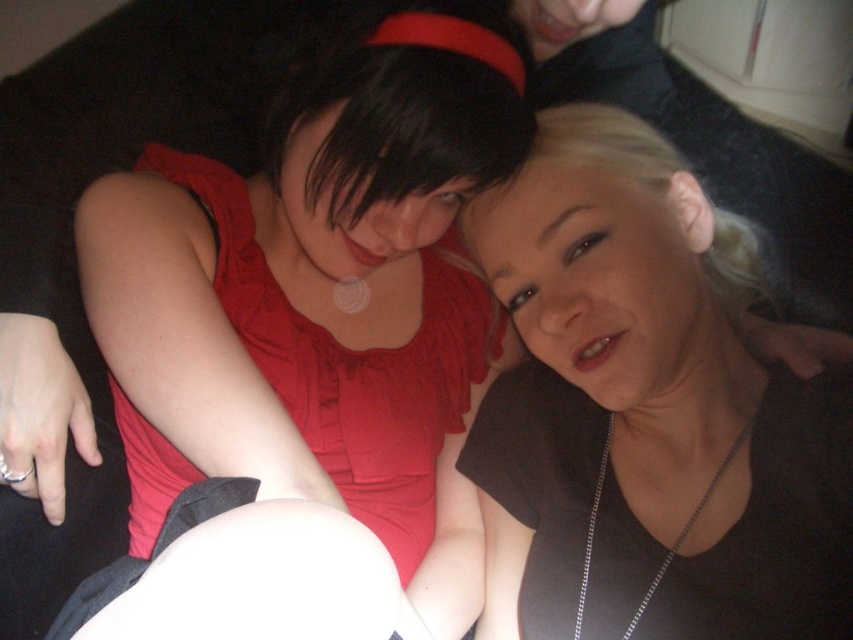
You are a photographer taking a portrait of two people sitting on a couch. You notice the matte red dress at center and the silver chain necklace at center. Which object is closer to the camera?

The matte red dress at center is closer to the camera because it is in front of the silver chain necklace at center.

You are a photographer standing at a certain distance from the matte black shirt at center. If you want to take a clear photo of it, should you move closer or farther away?

The distance between the matte black shirt at center and the camera is 23.82 inches. To take a clear photo, you should move closer to the matte black shirt at center if you want to focus on it more, or stay at the current distance if the current framing is acceptable. However, if the camera requires a closer focus distance, moving closer might be necessary.

You are a photographer who needs to adjust the lighting so that both the matte red dress at center and the matte black shirt at center are equally illuminated. Given their height difference, where should you position the light source relative to them?

The matte red dress at center is much taller than the matte black shirt at center. To equally illuminate both, position the light source higher above the taller matte red dress at center so that the light reaches both objects proportionally.